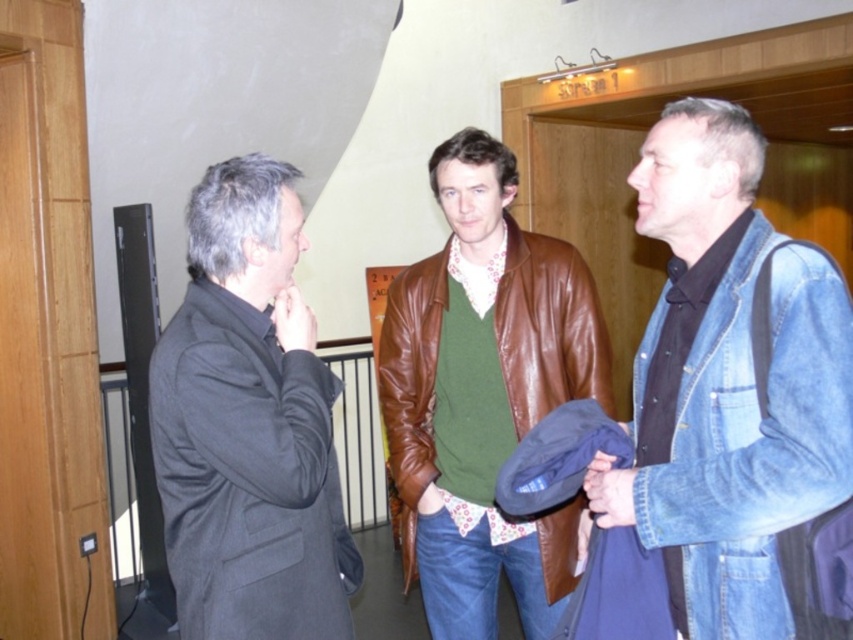
You are an interior designer assessing the layout of this hallway. You notice the denim jacket at right and the dark gray wool coat at left. Which of these two items is positioned higher up in the image?

The denim jacket at right is much taller than the dark gray wool coat at left, so it is positioned higher up in the image.

You are a photographer positioned at the end of the hallway. You want to take a photo that includes both the denim jacket at right and the brown leather jacket at center. Which jacket should you adjust your position to focus on first to ensure both are in the frame?

The denim jacket at right is in front of the brown leather jacket at center, so you should focus on the denim jacket at right first to ensure both are visible in the frame.

In the scene, there are two people wearing jackets. The denim jacket at right and the dark gray wool coat at left. Which jacket is positioned to the right side of the other?

The denim jacket at right is to the right of the dark gray wool coat at left.